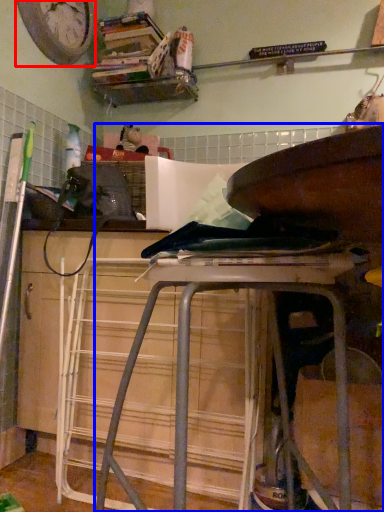
Question: Which object appears farthest to the camera in this image, clock (highlighted by a red box) or furniture (highlighted by a blue box)?

Choices:
 (A) clock
 (B) furniture

Answer: (A)